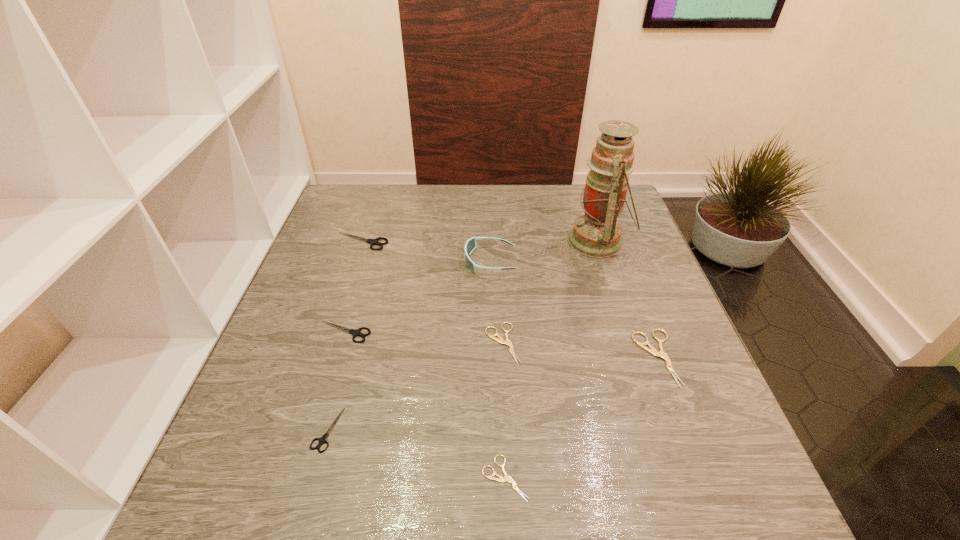
The image size is (960, 540). Identify the location of oil lamp. (597, 234).

You are a GUI agent. You are given a task and a screenshot of the screen. Output one action in this format:
    pyautogui.click(x=<x>, y=<y>)
    Task: Click on the tallest object
    This screenshot has width=960, height=540.
    Given the screenshot: What is the action you would take?
    pyautogui.click(x=597, y=234)

The image size is (960, 540). In order to click on the seventh shortest object in this screenshot , I will do [470, 245].

Identify the location of the tallest shears. (371, 241).

At what (x,y) coordinates should I click in order to perform the action: click on the third tallest object. Please return your answer as a coordinate pair (x, y). Image resolution: width=960 pixels, height=540 pixels. Looking at the image, I should click on (371, 241).

What are the coordinates of `the second biggest black shears` in the screenshot? It's located at (355, 332).

Locate an element on the screen. Image resolution: width=960 pixels, height=540 pixels. the rightmost beige shears is located at coordinates (652, 350).

Locate an element on the screen. The height and width of the screenshot is (540, 960). the rightmost shears is located at coordinates (652, 350).

Find the location of a particular element. The height and width of the screenshot is (540, 960). the second smallest beige shears is located at coordinates (500, 340).

The image size is (960, 540). What are the coordinates of `the smallest black shears` in the screenshot? It's located at (322, 440).